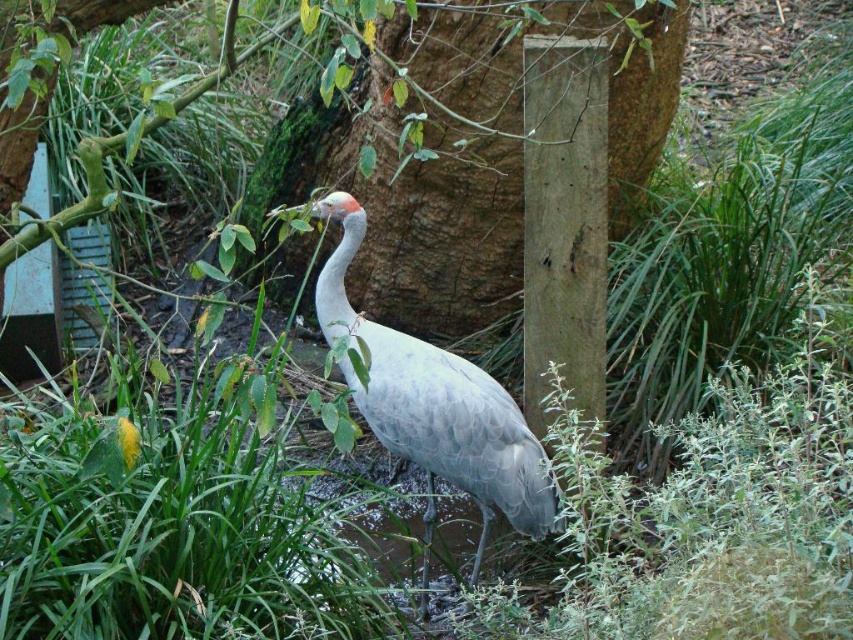
Based on the photo, is brown rough tree trunk at center smaller than gray matte bird at center?

No, brown rough tree trunk at center is not smaller than gray matte bird at center.

Does point (635, 148) come closer to viewer compared to point (544, 513)?

No.

I want to click on brown rough tree trunk at center, so click(x=405, y=205).